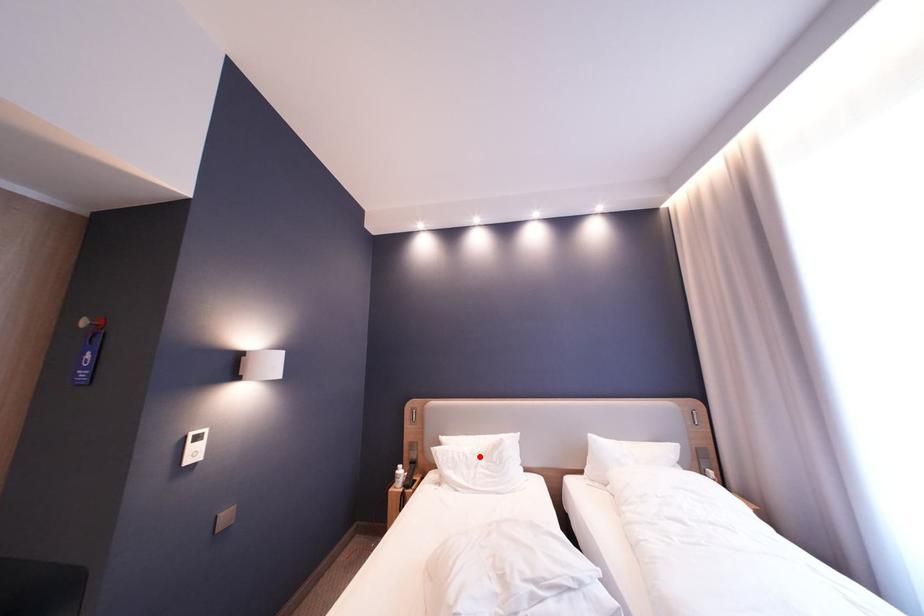
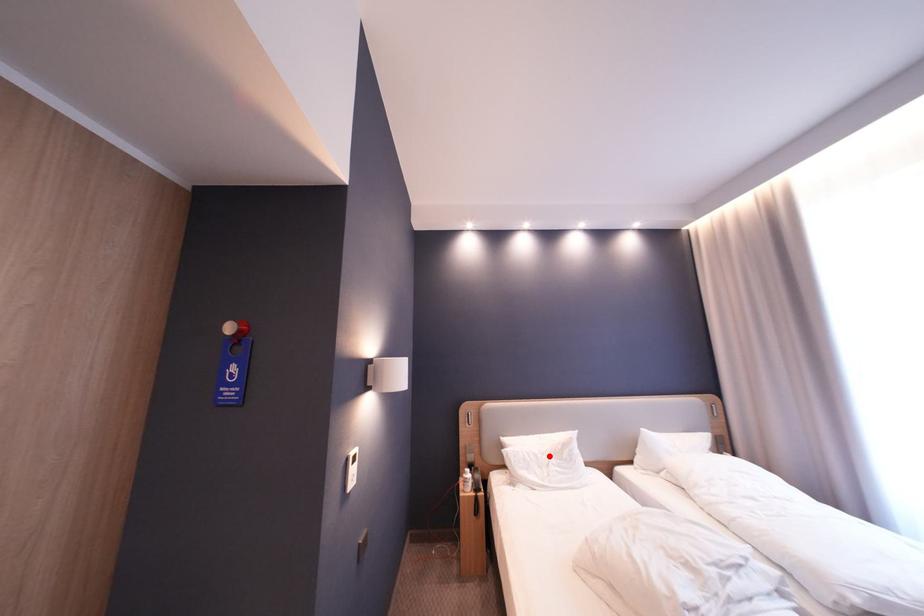
I am providing you with two images of the same scene from different viewpoints. A red point is marked on the first image and another point is marked on the second image. Does the point marked in image1 correspond to the same location as the one in image2?

Yes